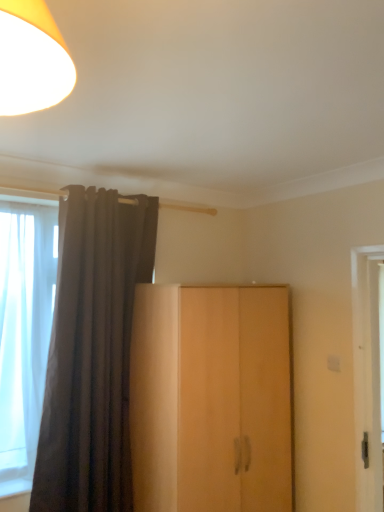
Question: In terms of size, does dark grey velvet curtain at left appear bigger or smaller than light wood cupboard at center?

Choices:
 (A) big
 (B) small

Answer: (B)

Question: Looking at their shapes, would you say dark grey velvet curtain at left is wider or thinner than light wood cupboard at center?

Choices:
 (A) thin
 (B) wide

Answer: (A)

Question: From a real-world perspective, is dark grey velvet curtain at left physically located above or below light wood cupboard at center?

Choices:
 (A) below
 (B) above

Answer: (B)

Question: Would you say light wood cupboard at center is inside or outside dark grey velvet curtain at left?

Choices:
 (A) inside
 (B) outside

Answer: (B)

Question: From a real-world perspective, is light wood cupboard at center physically located above or below dark grey velvet curtain at left?

Choices:
 (A) above
 (B) below

Answer: (B)

Question: In the image, is light wood cupboard at center positioned in front of or behind dark grey velvet curtain at left?

Choices:
 (A) front
 (B) behind

Answer: (A)

Question: Considering the positions of point (200, 355) and point (89, 378), is point (200, 355) closer or farther from the camera than point (89, 378)?

Choices:
 (A) farther
 (B) closer

Answer: (B)